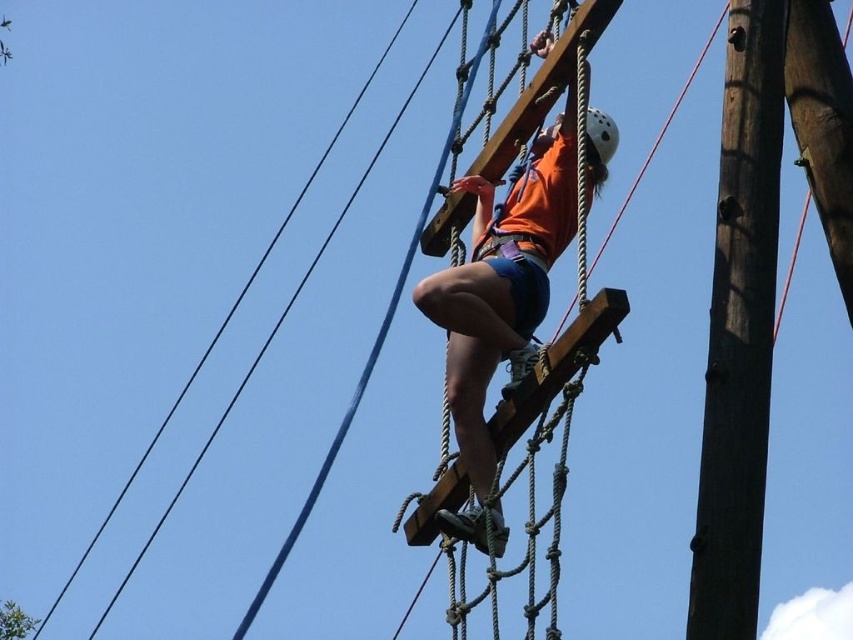
Between brown rough wood pole at right and white matte helmet at upper center, which one appears on the right side from the viewer's perspective?

Positioned to the right is brown rough wood pole at right.

Is point (697, 486) positioned before point (611, 148)?

No, (697, 486) is behind (611, 148).

Is point (770, 129) closer to viewer compared to point (585, 125)?

Yes, point (770, 129) is closer to viewer.

I want to click on brown rough wood pole at right, so click(740, 330).

Is point (590, 176) closer to viewer compared to point (598, 129)?

That is True.

Identify the location of orange fabric shirt at center. The height and width of the screenshot is (640, 853). (497, 314).

Is point (698, 486) closer to viewer compared to point (512, 280)?

No, (698, 486) is behind (512, 280).

Can you confirm if brown rough wood pole at right is positioned to the right of orange fabric shirt at center?

Yes, brown rough wood pole at right is to the right of orange fabric shirt at center.

Is point (740, 548) in front of point (444, 314)?

Yes, point (740, 548) is in front of point (444, 314).

Locate an element on the screen. brown rough wood pole at right is located at coordinates (740, 330).